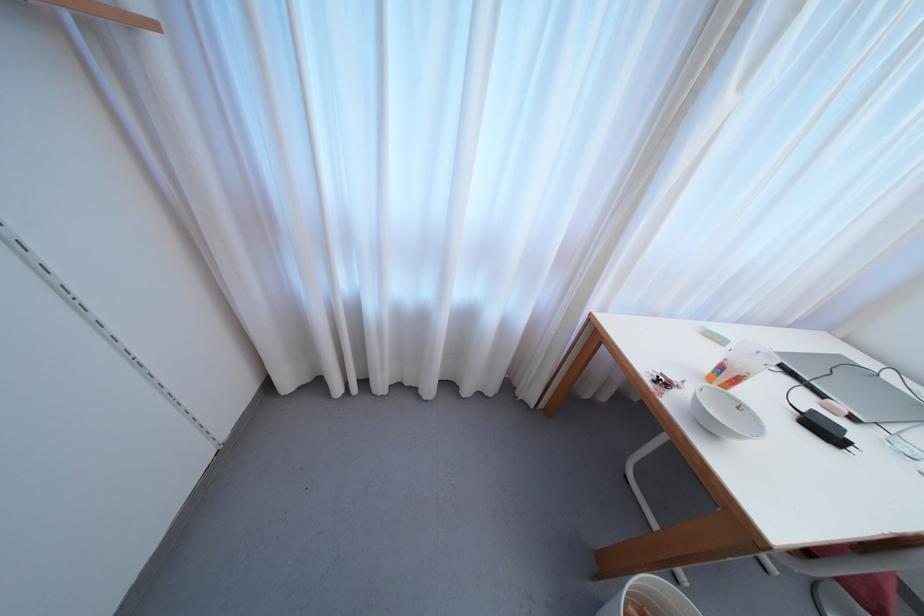
The image size is (924, 616). What do you see at coordinates (398, 331) in the screenshot?
I see `the white curtain edge` at bounding box center [398, 331].